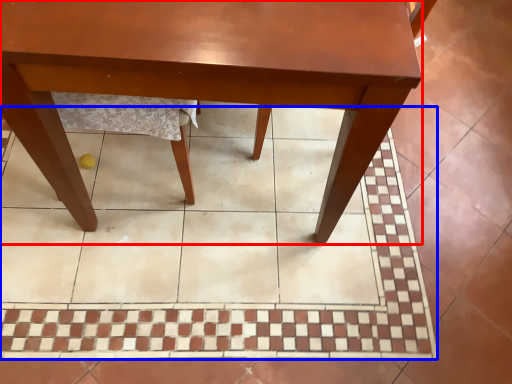
Question: Which object appears farthest to the camera in this image, table (highlighted by a red box) or ceramic tile (highlighted by a blue box)?

Choices:
 (A) table
 (B) ceramic tile

Answer: (B)